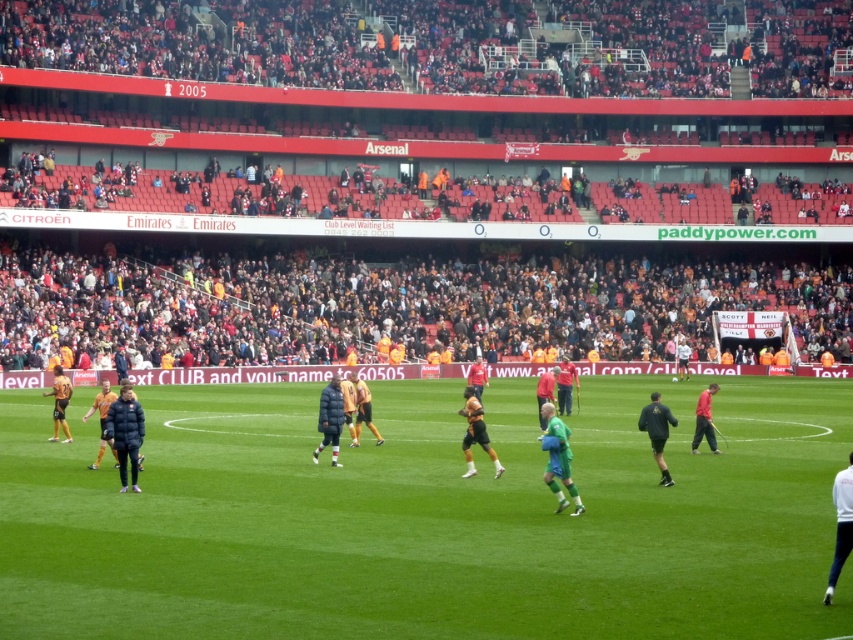
Who is lower down, green grass field at center or dark blue padded jacket at center?

green grass field at center is below.

How much distance is there between green grass field at center and dark blue padded jacket at center?

The distance of green grass field at center from dark blue padded jacket at center is 26.07 feet.

You are a GUI agent. You are given a task and a screenshot of the screen. Output one action in this format:
    pyautogui.click(x=<x>, y=<y>)
    Task: Click on the green grass field at center
    The image size is (853, 640).
    Given the screenshot: What is the action you would take?
    pyautogui.click(x=428, y=518)

Can you confirm if matte black jacket at center is smaller than orange jersey at center?

Yes.

Which of these two, matte black jacket at center or orange jersey at center, stands shorter?

matte black jacket at center is shorter.

What do you see at coordinates (125, 433) in the screenshot?
I see `matte black jacket at center` at bounding box center [125, 433].

Locate an element on the screen. This screenshot has width=853, height=640. matte black jacket at center is located at coordinates (125, 433).

Image resolution: width=853 pixels, height=640 pixels. What do you see at coordinates (474, 433) in the screenshot?
I see `black jersey at center` at bounding box center [474, 433].

How much distance is there between black jersey at center and orange jersey at center?

The distance of black jersey at center from orange jersey at center is 5.98 meters.

Between point (476, 422) and point (91, 413), which one is positioned in front?

Point (476, 422) is more forward.

The image size is (853, 640). I want to click on black jersey at center, so click(474, 433).